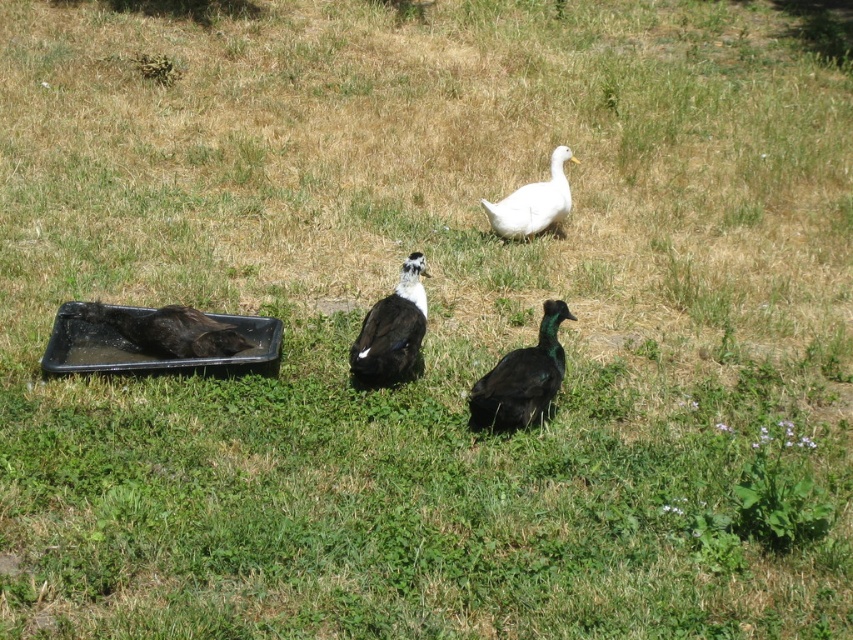
Is black glossy duck at center smaller than black matte tray at left?

No.

Identify the location of black glossy duck at center. (392, 330).

Between green glossy duck at center and black glossy duck at center, which one is positioned higher?

black glossy duck at center

From the picture: Who is lower down, green glossy duck at center or black glossy duck at center?

green glossy duck at center is lower down.

The height and width of the screenshot is (640, 853). Describe the element at coordinates (521, 378) in the screenshot. I see `green glossy duck at center` at that location.

The width and height of the screenshot is (853, 640). Find the location of `green glossy duck at center`. green glossy duck at center is located at coordinates (521, 378).

Can you confirm if green glossy duck at center is positioned to the right of black matte tray at left?

Yes, green glossy duck at center is to the right of black matte tray at left.

This screenshot has height=640, width=853. What do you see at coordinates (521, 378) in the screenshot?
I see `green glossy duck at center` at bounding box center [521, 378].

Who is more forward, (527, 356) or (207, 321)?

Point (527, 356)

Locate an element on the screen. The width and height of the screenshot is (853, 640). green glossy duck at center is located at coordinates (521, 378).